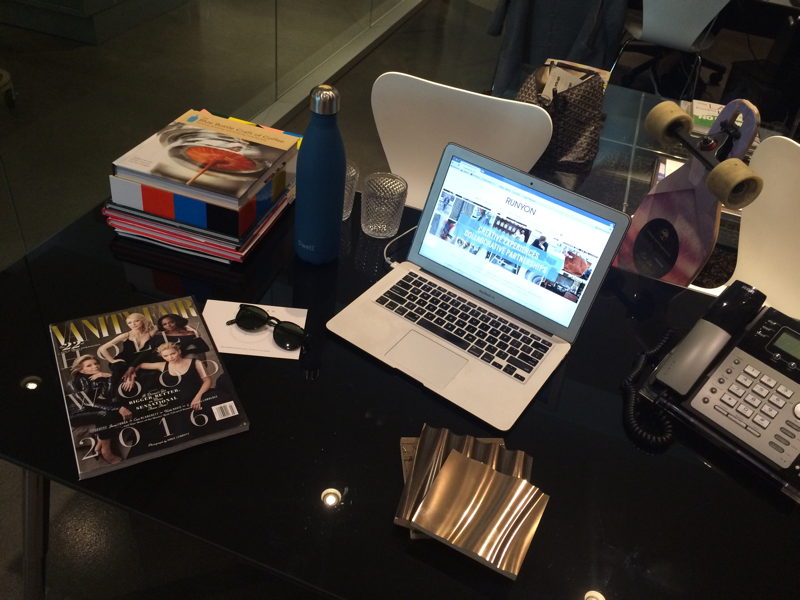
The width and height of the screenshot is (800, 600). What are the coordinates of `laptop` in the screenshot? It's located at (497, 398).